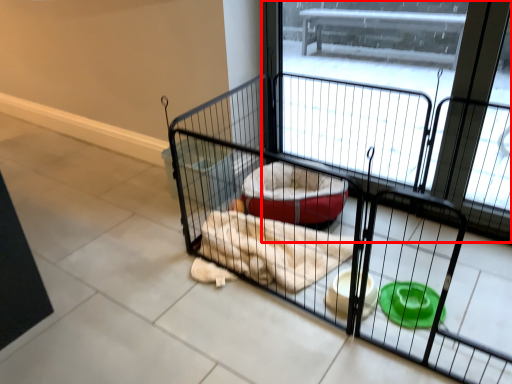
Question: From the image's perspective, what is the correct spatial relationship of screen door (annotated by the red box) in relation to cage?

Choices:
 (A) above
 (B) below

Answer: (A)